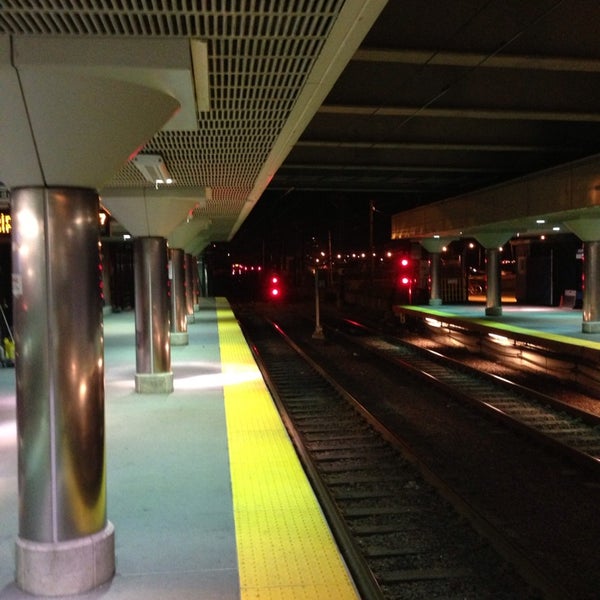
Where is `ceiling`? The width and height of the screenshot is (600, 600). ceiling is located at coordinates (447, 104).